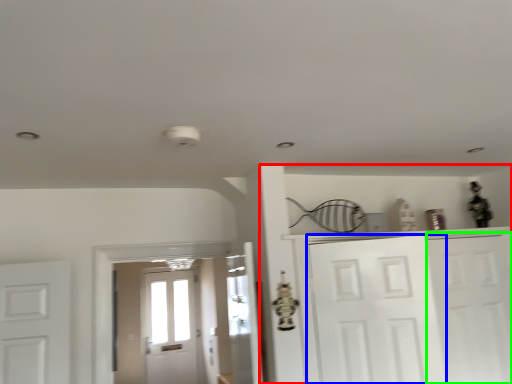
Question: Which is farther away from dresser (highlighted by a red box)? door (highlighted by a blue box) or door (highlighted by a green box)?

Choices:
 (A) door
 (B) door

Answer: (B)